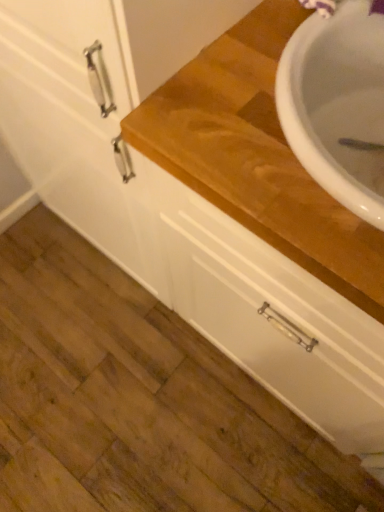
Locate an element on the screen. Image resolution: width=384 pixels, height=512 pixels. empty space that is ontop of white matte drawer at center (from a real-world perspective) is located at coordinates (127, 379).